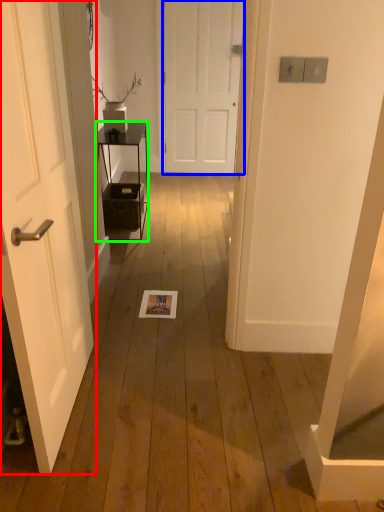
Question: Which object is positioned farthest from door (highlighted by a red box)? Select from door (highlighted by a blue box) and furniture (highlighted by a green box).

Choices:
 (A) door
 (B) furniture

Answer: (A)